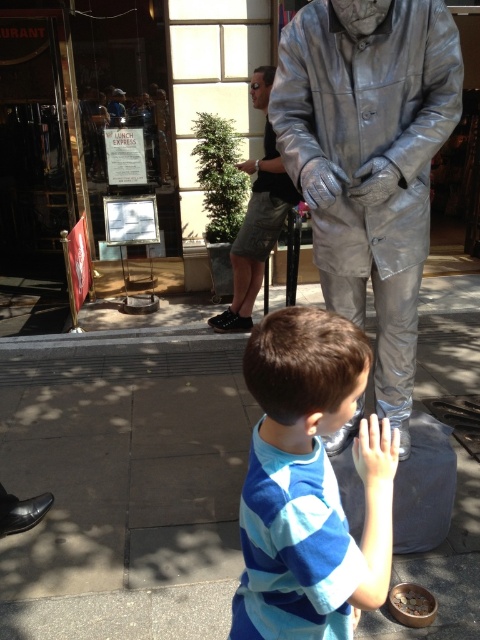
Question: Does blue striped shirt at center appear under silver metallic statue at center?

Choices:
 (A) yes
 (B) no

Answer: (A)

Question: Which object appears closest to the camera in this image?

Choices:
 (A) gray concrete sidewalk at center
 (B) blue striped shirt at center

Answer: (B)

Question: Which of the following is the closest to the observer?

Choices:
 (A) (334, 144)
 (B) (252, 595)
 (C) (279, 195)
 (D) (233, 534)

Answer: (B)

Question: Is shiny metallic suit at center in front of matte silver hand at lower center?

Choices:
 (A) no
 (B) yes

Answer: (A)

Question: Considering the relative positions of shiny metallic suit at center and blue striped shirt at center in the image provided, where is shiny metallic suit at center located with respect to blue striped shirt at center?

Choices:
 (A) right
 (B) left

Answer: (A)

Question: Which object appears farthest from the camera in this image?

Choices:
 (A) shiny metallic suit at center
 (B) gray concrete sidewalk at center
 (C) blue striped shirt at center
 (D) matte silver hand at lower center

Answer: (B)